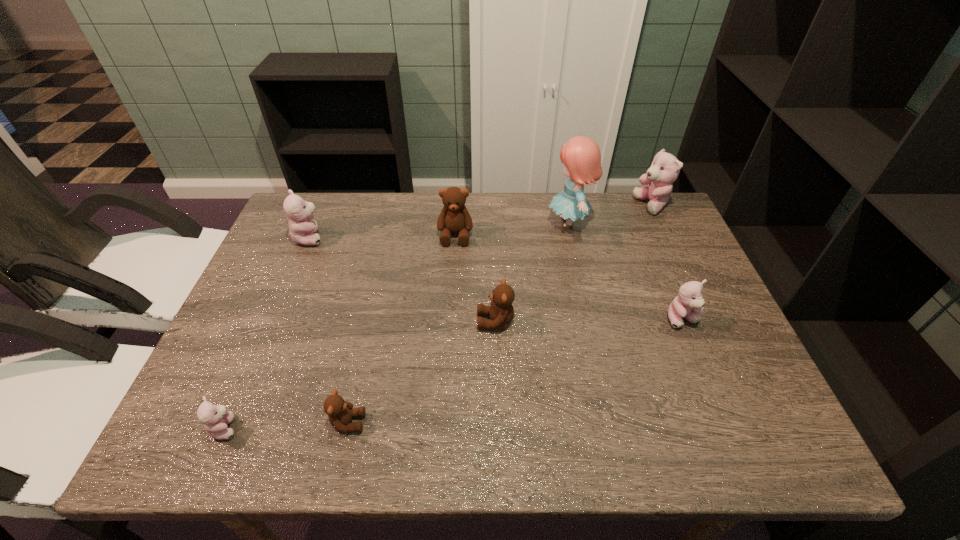
Identify the location of the tallest object. The image size is (960, 540). (581, 156).

Locate an element on the screen. the third object from right to left is located at coordinates (581, 156).

The width and height of the screenshot is (960, 540). In order to click on the farthest teddy bear in this screenshot , I will do `click(665, 168)`.

The height and width of the screenshot is (540, 960). Identify the location of the biggest pink teddy bear. (665, 168).

This screenshot has height=540, width=960. I want to click on the third smallest pink teddy bear, so click(299, 212).

Locate an element on the screen. This screenshot has width=960, height=540. the biggest brown teddy bear is located at coordinates (454, 218).

At what (x,y) coordinates should I click in order to perform the action: click on the second brown teddy bear from left to right. Please return your answer as a coordinate pair (x, y). Looking at the image, I should click on (454, 218).

This screenshot has height=540, width=960. What are the coordinates of `the second nearest brown teddy bear` in the screenshot? It's located at (501, 312).

Locate an element on the screen. This screenshot has width=960, height=540. the third teddy bear from right to left is located at coordinates (501, 312).

This screenshot has width=960, height=540. I want to click on the third farthest pink teddy bear, so click(688, 304).